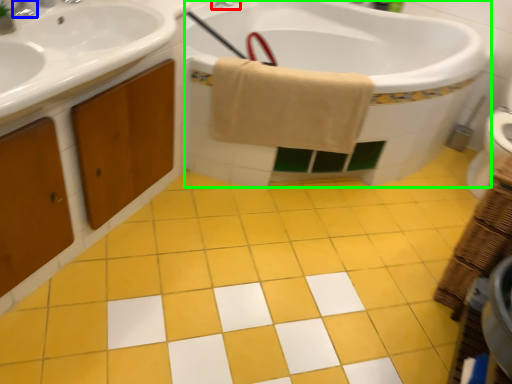
Question: Which is farther away from tap (highlighted by a red box)? tap (highlighted by a blue box) or bath (highlighted by a green box)?

Choices:
 (A) tap
 (B) bath

Answer: (A)